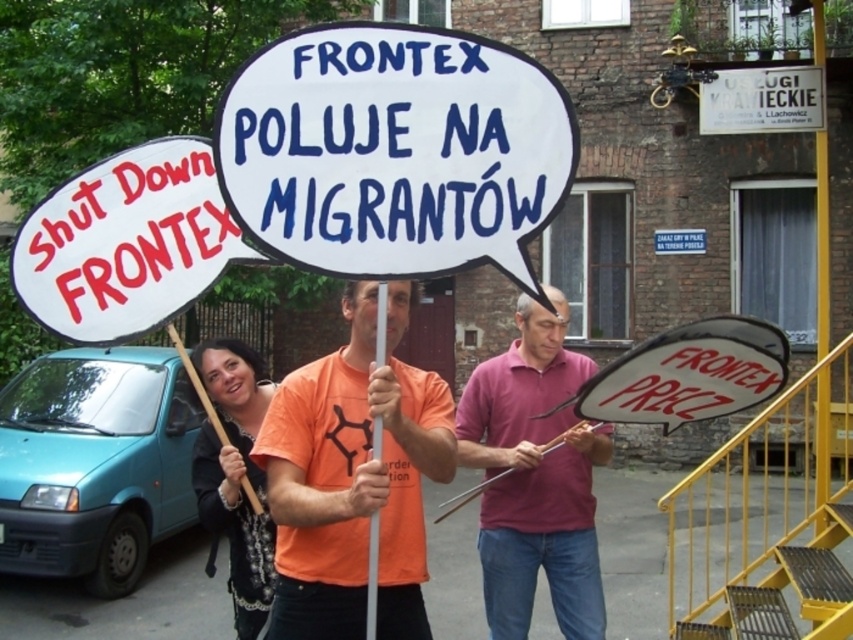
Question: Which object is the farthest from the black fabric shirt at center?

Choices:
 (A) orange t-shirt at center
 (B) pink cotton shirt at center

Answer: (B)

Question: Does orange t-shirt at center appear under black fabric shirt at center?

Choices:
 (A) no
 (B) yes

Answer: (A)

Question: Which object is closer to the camera taking this photo?

Choices:
 (A) orange t-shirt at center
 (B) pink cotton shirt at center

Answer: (A)

Question: Can you confirm if pink cotton shirt at center is wider than black fabric shirt at center?

Choices:
 (A) yes
 (B) no

Answer: (A)

Question: Considering the real-world distances, which object is closest to the orange t-shirt at center?

Choices:
 (A) black fabric shirt at center
 (B) pink cotton shirt at center

Answer: (A)

Question: Can you confirm if orange t-shirt at center is positioned below pink cotton shirt at center?

Choices:
 (A) yes
 (B) no

Answer: (B)